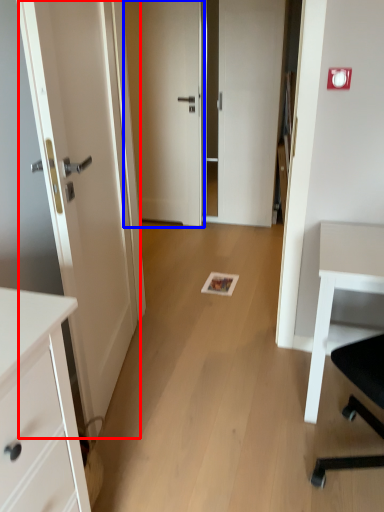
Question: Which object appears farthest to the camera in this image, door (highlighted by a red box) or door (highlighted by a blue box)?

Choices:
 (A) door
 (B) door

Answer: (B)